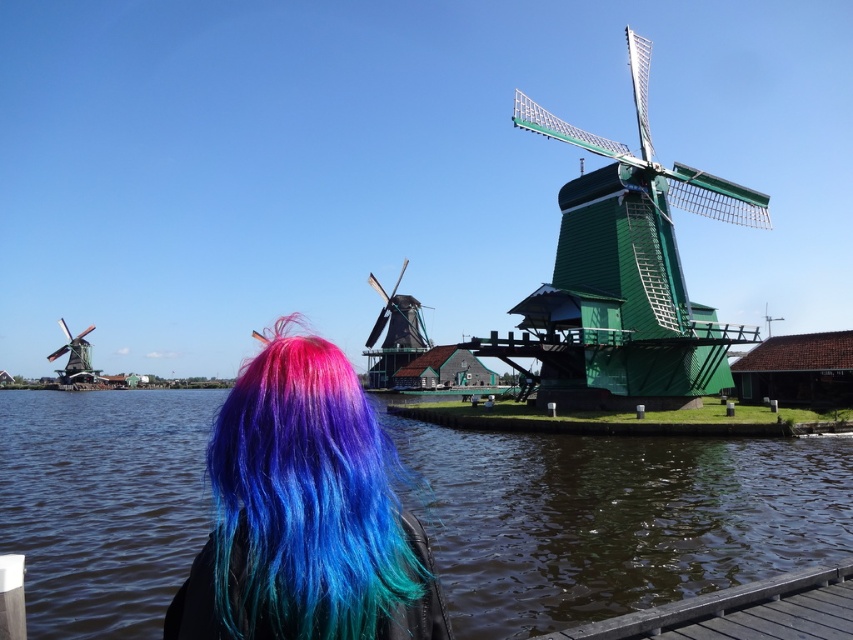
Question: Can you confirm if brown wooden dock at lower right is thinner than green wooden windmill at left?

Choices:
 (A) no
 (B) yes

Answer: (B)

Question: Which object is farther from the camera taking this photo?

Choices:
 (A) green wooden windmill at center
 (B) multicolored hair at center
 (C) transparent water at lower center
 (D) brown wooden dock at lower right

Answer: (A)

Question: Which point is closer to the camera?

Choices:
 (A) (381, 374)
 (B) (706, 611)
 (C) (142, 474)

Answer: (B)

Question: Can you confirm if transparent water at lower center is thinner than multicolored hair at center?

Choices:
 (A) yes
 (B) no

Answer: (B)

Question: Considering the real-world distances, which object is closest to the multicolored hair at center?

Choices:
 (A) green wooden windmill at center
 (B) green wooden windmill at left
 (C) wooden planks windmill at center

Answer: (A)

Question: Can you confirm if multicolored hair at center is thinner than green wooden windmill at left?

Choices:
 (A) yes
 (B) no

Answer: (B)